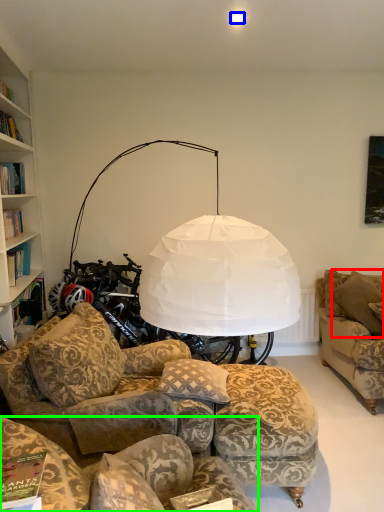
Question: Based on their relative distances, which object is nearer to pillow (highlighted by a red box)? Choose from lighting (highlighted by a blue box) and studio couch (highlighted by a green box).

Choices:
 (A) lighting
 (B) studio couch

Answer: (B)